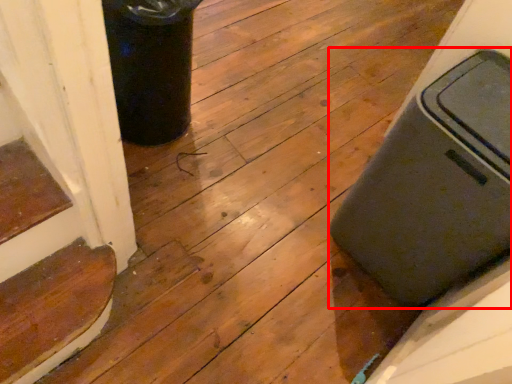
Question: Considering the relative positions of waste container (annotated by the red box) and stairwell in the image provided, where is waste container (annotated by the red box) located with respect to the staircase?

Choices:
 (A) left
 (B) right

Answer: (B)